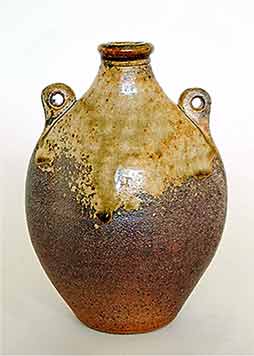
You are a GUI agent. You are given a task and a screenshot of the screen. Output one action in this format:
    pyautogui.click(x=<x>, y=<y>)
    Task: Click on the light reflecting off of vase
    
    Given the screenshot: What is the action you would take?
    pyautogui.click(x=132, y=182)